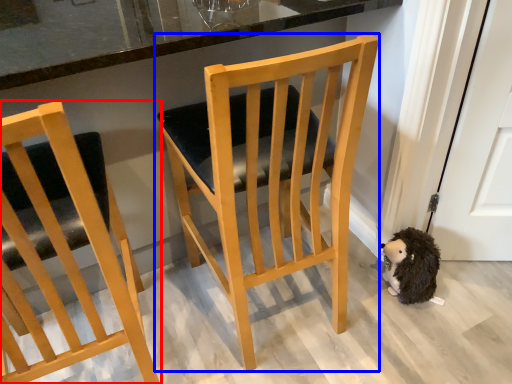
Question: Which object appears closest to the camera in this image, chair (highlighted by a red box) or chair (highlighted by a blue box)?

Choices:
 (A) chair
 (B) chair

Answer: (A)